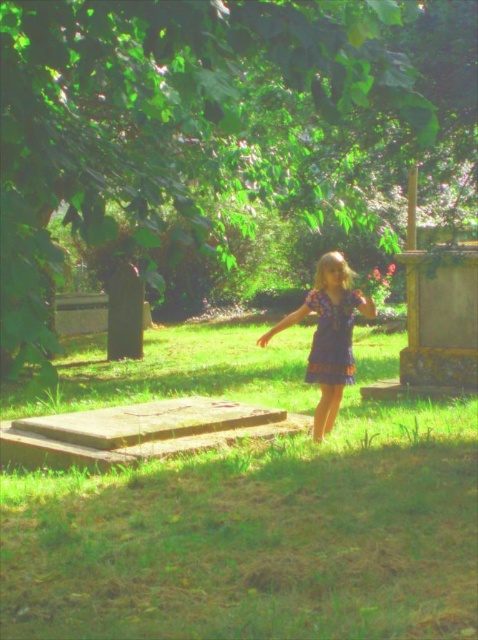
You are standing at point (260, 532) in the scene. What is the terrain like at that location?

The terrain at point (260, 532) is green grass at center.

Based on the photo, you are a photographer trying to capture the purple cotton dress at center in the image. According to the coordinates provided, where exactly should you focus your camera to ensure the dress is centered in your shot?

To capture the purple cotton dress at center, focus your camera at the coordinates point (x=328, y=333) where the dress is located.